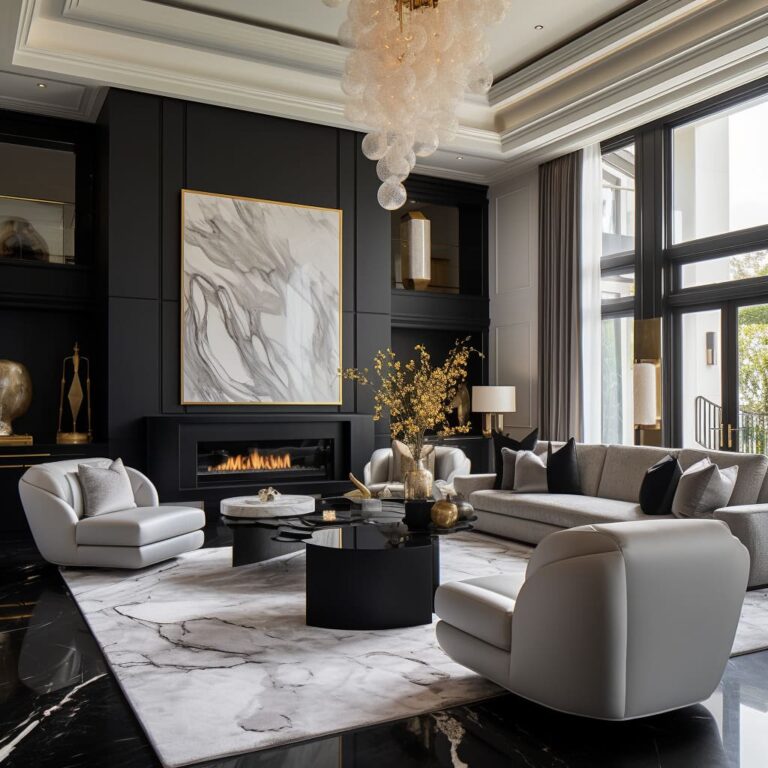
Find the location of a particular element. Image resolution: width=768 pixels, height=768 pixels. lamp is located at coordinates 490,399.